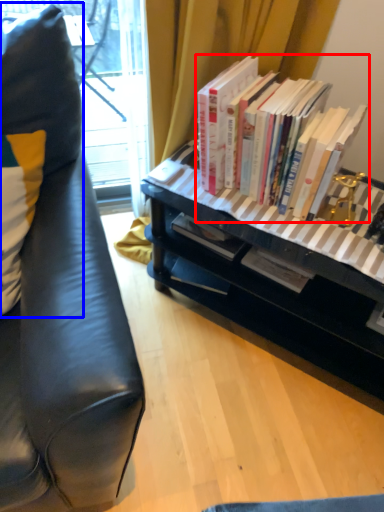
Question: Among these objects, which one is farthest to the camera, book (highlighted by a red box) or pillow (highlighted by a blue box)?

Choices:
 (A) book
 (B) pillow

Answer: (A)